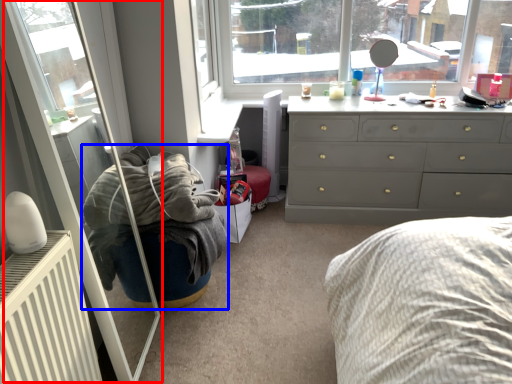
Question: Which object appears closest to the camera in this image, screen door (highlighted by a red box) or bean bag chair (highlighted by a blue box)?

Choices:
 (A) screen door
 (B) bean bag chair

Answer: (A)